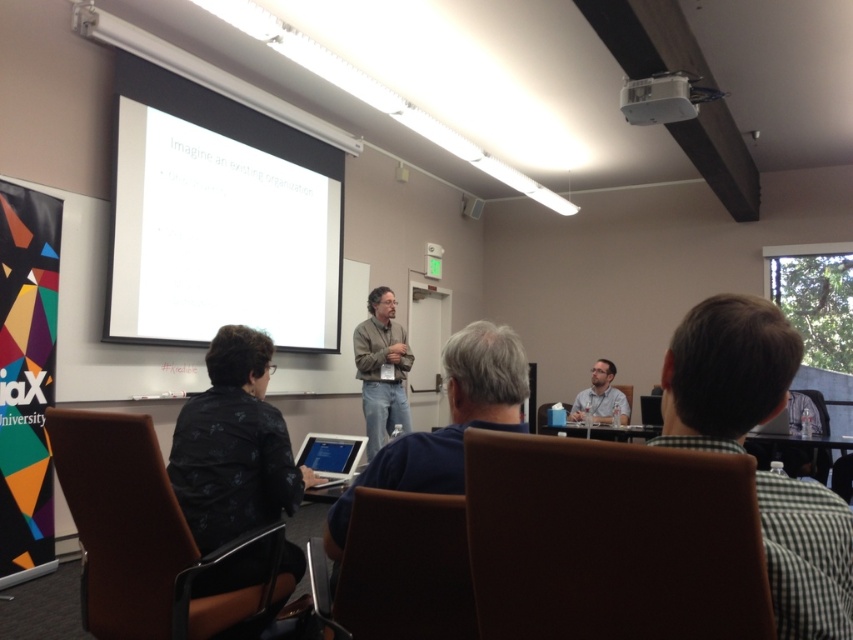
You are an attendee sitting in the back row of the room. You notice the white matte projection screen at upper center and the white plastic projector at upper center. Which object is closer to you?

The white matte projection screen at upper center is closer to you because it is further to the viewer than the white plastic projector at upper center.

You are an attendee at this seminar and you need to retrieve your black textured jacket at lower left. The presenter is standing at the front of the room. Which direction should you walk to reach your jacket?

You should walk towards the lower left direction to reach your black textured jacket at lower left.

In the scene described, there are two jackets present. The black textured jacket at lower left and the light brown leather jacket at center. From the perspective of someone sitting in the audience facing the front of the room, which jacket is positioned more to the left?

The black textured jacket at lower left is positioned to the left of the light brown leather jacket at center, so from the audience perspective facing front, the black textured jacket at lower left is more to the left.